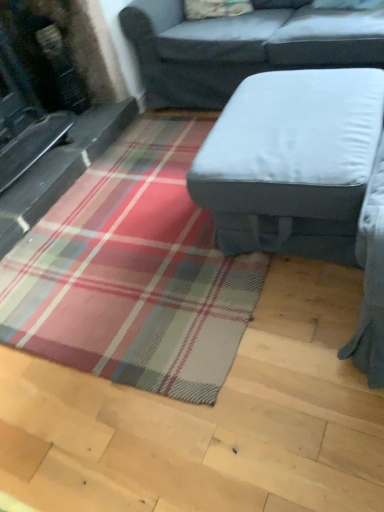
I want to click on free point above light gray fabric ottoman at center, which is the second studio couch from top to bottom (from a real-world perspective), so click(296, 114).